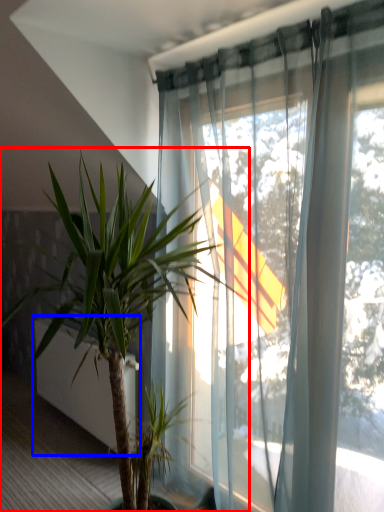
Question: Which point is closer to the camera, houseplant (highlighted by a red box) or screen door (highlighted by a blue box)?

Choices:
 (A) houseplant
 (B) screen door

Answer: (A)